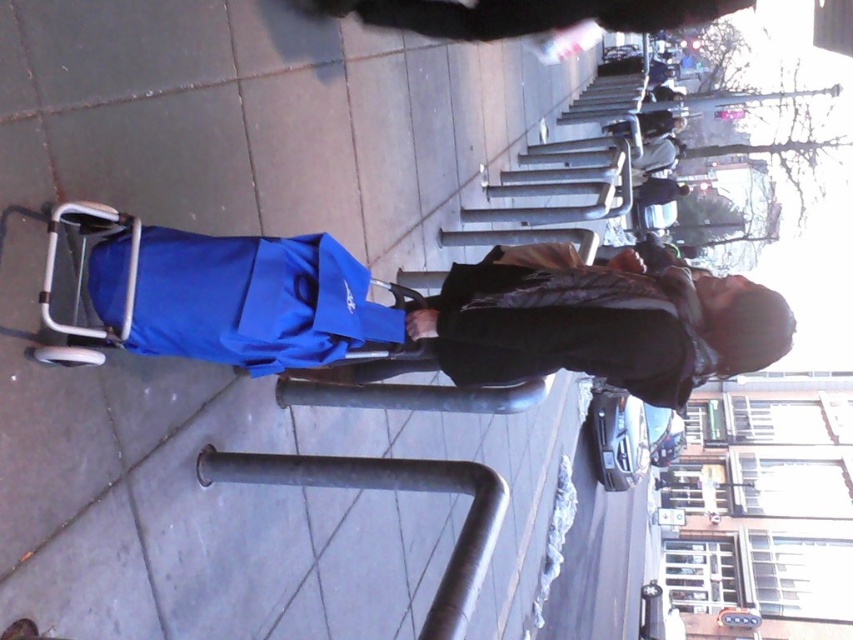
Question: Is blue fabric bag at center positioned behind blue fabric jacket at center?

Choices:
 (A) no
 (B) yes

Answer: (B)

Question: Is blue fabric bag at center positioned before dark gray metal rail at center?

Choices:
 (A) no
 (B) yes

Answer: (A)

Question: Which of the following is the closest to the observer?

Choices:
 (A) blue fabric jacket at center
 (B) blue fabric bag at center
 (C) dark gray metal rail at center

Answer: (C)

Question: Is blue fabric jacket at center below dark gray metal rail at center?

Choices:
 (A) yes
 (B) no

Answer: (B)

Question: Which point appears closest to the camera in this image?

Choices:
 (A) (170, 349)
 (B) (273, 339)

Answer: (B)

Question: Which of the following is the farthest from the observer?

Choices:
 (A) dark gray metal rail at center
 (B) blue fabric bag at center
 (C) blue fabric jacket at center

Answer: (B)